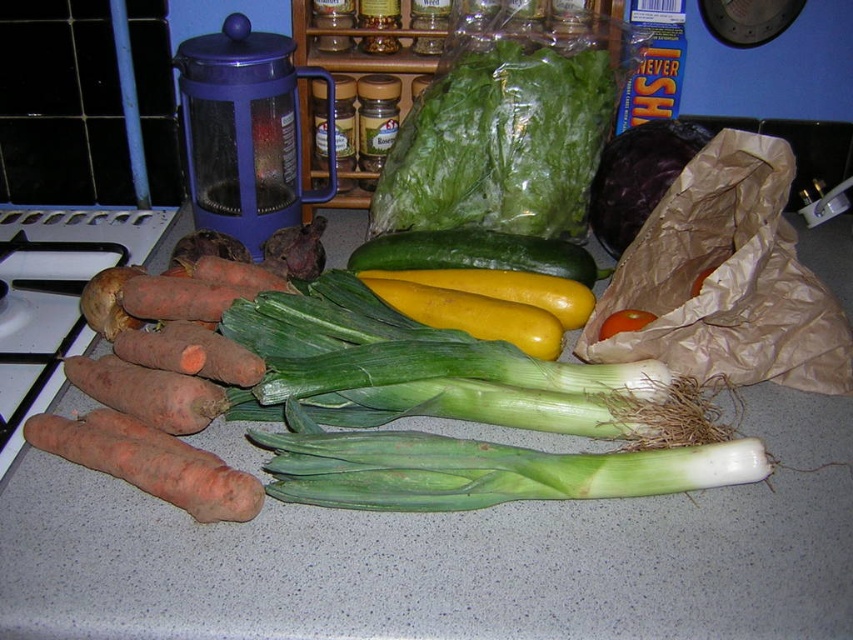
Question: Which point is farther to the camera?

Choices:
 (A) (524, 97)
 (B) (447, 241)

Answer: (B)

Question: Based on their relative distances, which object is farther from the smooth gray countertop at center?

Choices:
 (A) green leafy lettuce at center
 (B) orange matte carrot at left
 (C) green smooth skin zucchini at center
 (D) red matte tomato at center

Answer: (A)

Question: Which point appears closest to the camera in this image?

Choices:
 (A) (84, 460)
 (B) (132, 275)
 (C) (564, 624)

Answer: (C)

Question: Does smooth gray countertop at center appear under green leafy lettuce at center?

Choices:
 (A) no
 (B) yes

Answer: (B)

Question: Is green leafy lettuce at center to the left of orange matte carrot at left from the viewer's perspective?

Choices:
 (A) no
 (B) yes

Answer: (A)

Question: In this image, where is green smooth skin zucchini at center located relative to orange matte carrot at left?

Choices:
 (A) left
 (B) right

Answer: (B)